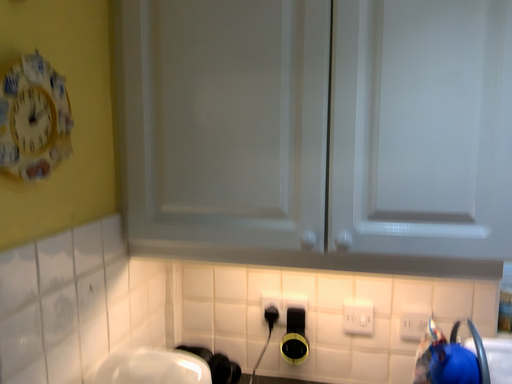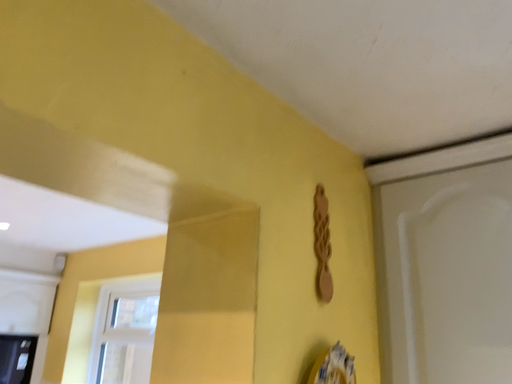
Question: How did the camera likely rotate when shooting the video?

Choices:
 (A) rotated downward
 (B) rotated upward

Answer: (B)